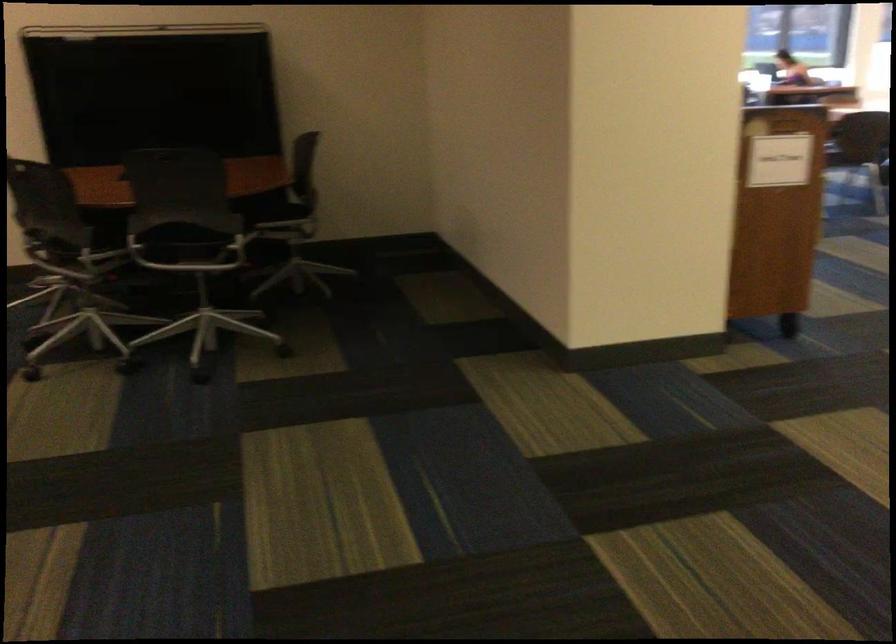
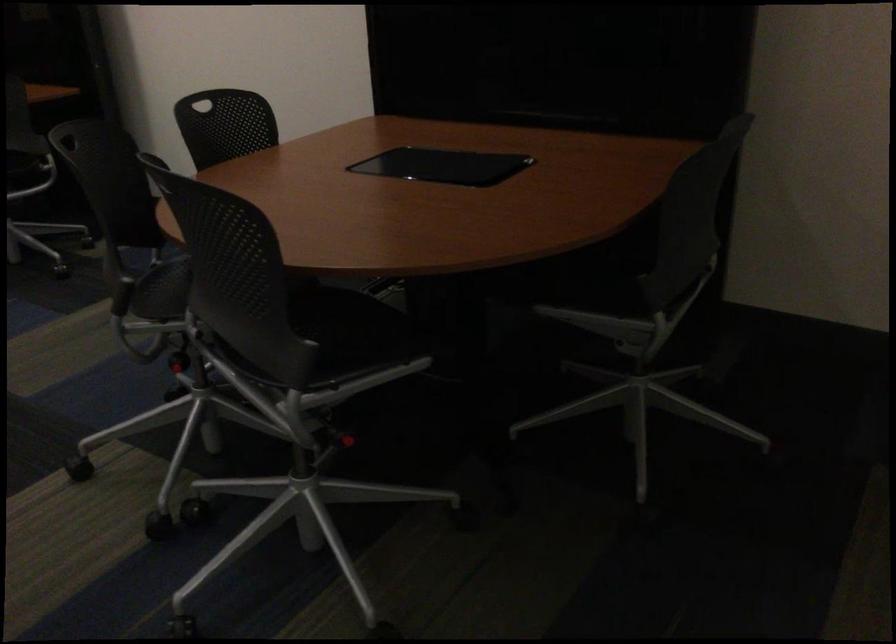
Locate, in the second image, the point that corresponds to [222,166] in the first image.

(612, 272)